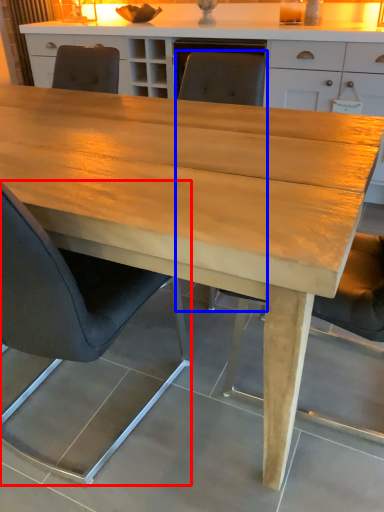
Question: Among these objects, which one is farthest to the camera, chair (highlighted by a red box) or chair (highlighted by a blue box)?

Choices:
 (A) chair
 (B) chair

Answer: (B)